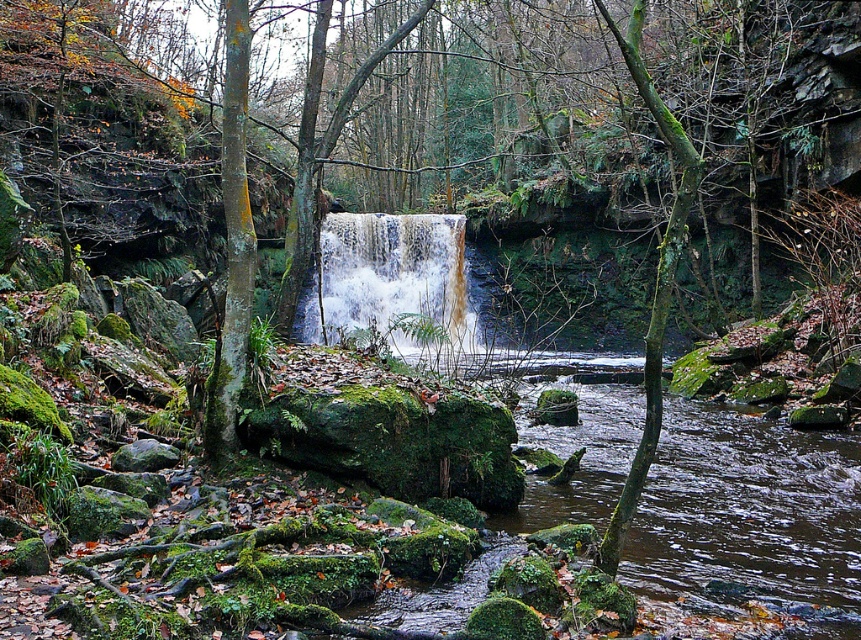
Does brown/muddy water at lower center come behind brown textured waterfall at center?

No, brown/muddy water at lower center is in front of brown textured waterfall at center.

Which is in front, point (793, 483) or point (339, 304)?

Point (793, 483) is in front.

You are a GUI agent. You are given a task and a screenshot of the screen. Output one action in this format:
    pyautogui.click(x=<x>, y=<y>)
    Task: Click on the brown/muddy water at lower center
    
    Given the screenshot: What is the action you would take?
    pyautogui.click(x=748, y=518)